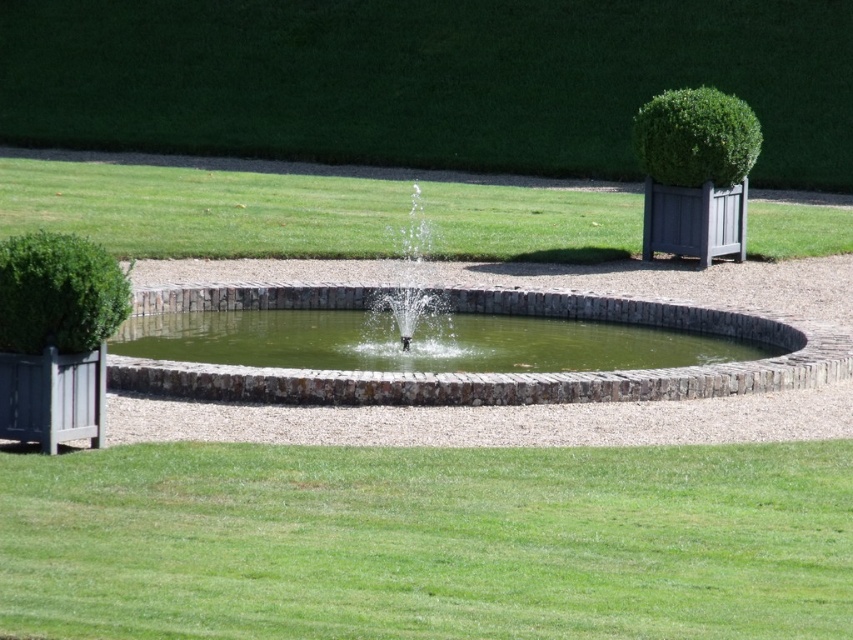
Does green stone water at center lie in front of green leafy bush at left?

No, it is not.

Is point (215, 324) positioned behind point (65, 340)?

Yes, point (215, 324) is farther from viewer.

Locate an element on the screen. green stone water at center is located at coordinates (418, 342).

Is point (15, 168) farther from viewer compared to point (686, 120)?

Yes, it is.

Which is above, green grass at upper center or green textured bush at upper right?

green textured bush at upper right is higher up.

I want to click on green grass at upper center, so click(x=204, y=209).

Image resolution: width=853 pixels, height=640 pixels. Identify the location of green grass at upper center. (204, 209).

Is green leafy bush at left shorter than clear water fountain at center?

Yes.

Who is more forward, [126,312] or [405,285]?

Point [126,312] is more forward.

At what (x,y) coordinates should I click in order to perform the action: click on green leafy bush at left. Please return your answer as a coordinate pair (x, y). Looking at the image, I should click on (57, 292).